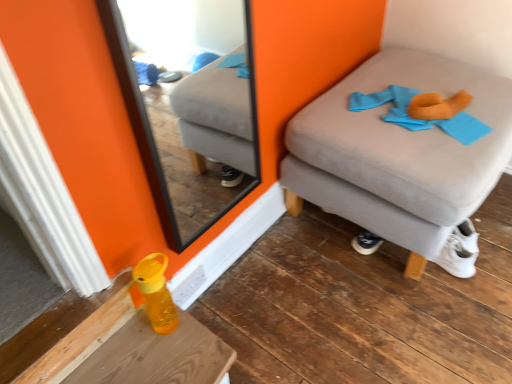
Where is `black-framed mirror at center`? This screenshot has height=384, width=512. black-framed mirror at center is located at coordinates (190, 104).

The image size is (512, 384). I want to click on suede ottoman at right, so click(399, 152).

What is the approximate height of wooden table at lower left?

The height of wooden table at lower left is 6.74 inches.

Find the location of a particular element. Image resolution: width=512 pixels, height=384 pixels. black-framed mirror at center is located at coordinates (190, 104).

Which of these two, blue fabric at upper right or suede ottoman at right, is bigger?

suede ottoman at right.

In the scene shown: Considering the positions of objects blue fabric at upper right and suede ottoman at right in the image provided, who is more to the right, blue fabric at upper right or suede ottoman at right?

suede ottoman at right.

Are blue fabric at upper right and suede ottoman at right located far from each other?

blue fabric at upper right is actually quite close to suede ottoman at right.

Is blue fabric at upper right looking in the opposite direction of suede ottoman at right?

Yes, blue fabric at upper right is facing away from suede ottoman at right.

From the image's perspective, is black-framed mirror at center located beneath wooden table at lower left?

Incorrect, from the image's perspective, black-framed mirror at center is higher than wooden table at lower left.

From a real-world perspective, does black-framed mirror at center stand above wooden table at lower left?

Yes, from a real-world perspective, black-framed mirror at center is on top of wooden table at lower left.

Consider the image. Considering the sizes of objects black-framed mirror at center and wooden table at lower left in the image provided, who is smaller, black-framed mirror at center or wooden table at lower left?

Smaller between the two is black-framed mirror at center.

Is black-framed mirror at center in contact with wooden table at lower left?

No, black-framed mirror at center is not with wooden table at lower left.

In the image, is wooden table at lower left on the left side or the right side of suede ottoman at right?

Clearly, wooden table at lower left is on the left of suede ottoman at right in the image.

Which point is more distant from viewer, (137, 363) or (325, 164)?

Point (325, 164)

Who is taller, wooden table at lower left or suede ottoman at right?

With more height is suede ottoman at right.

Who is smaller, wooden table at lower left or suede ottoman at right?

wooden table at lower left is smaller.

Considering the positions of points (366, 97) and (160, 332), is point (366, 97) closer to camera compared to point (160, 332)?

No, it is behind (160, 332).

At what (x,y) coordinates should I click in order to perform the action: click on clothe that appears behind the translucent yellow bottle at lower left. Please return your answer as a coordinate pair (x, y). Looking at the image, I should click on (423, 112).

Could you tell me if blue fabric at upper right is facing translucent yellow bottle at lower left?

No.

How many degrees apart are the facing directions of suede ottoman at right and blue fabric at upper right?

suede ottoman at right and blue fabric at upper right are facing 3.07 degrees away from each other.

Measure the distance between suede ottoman at right and blue fabric at upper right.

suede ottoman at right is 14.02 centimeters from blue fabric at upper right.

Is suede ottoman at right oriented towards blue fabric at upper right?

No, suede ottoman at right does not turn towards blue fabric at upper right.

Does suede ottoman at right contain blue fabric at upper right?

Yes, blue fabric at upper right can be found within suede ottoman at right.

Based on the photo, considering the sizes of objects black-framed mirror at center and blue fabric at upper right in the image provided, who is thinner, black-framed mirror at center or blue fabric at upper right?

black-framed mirror at center is thinner.

Considering the relative sizes of black-framed mirror at center and blue fabric at upper right in the image provided, is black-framed mirror at center taller than blue fabric at upper right?

Correct, black-framed mirror at center is much taller as blue fabric at upper right.

Are black-framed mirror at center and blue fabric at upper right far apart?

That's not correct — black-framed mirror at center is a little close to blue fabric at upper right.

Is wooden table at lower left to the right of blue fabric at upper right from the viewer's perspective?

No.

From a real-world perspective, is wooden table at lower left positioned under blue fabric at upper right based on gravity?

Yes, from a real-world perspective, wooden table at lower left is beneath blue fabric at upper right.

Does point (109, 318) lie behind point (385, 115)?

No, it is in front of (385, 115).

Is there a large distance between wooden table at lower left and blue fabric at upper right?

Indeed, wooden table at lower left is not near blue fabric at upper right.

Where is `clothe on the left of suede ottoman at right`? The image size is (512, 384). clothe on the left of suede ottoman at right is located at coordinates pos(423,112).

The width and height of the screenshot is (512, 384). In order to click on table below the black-framed mirror at center (from the image's perspective) in this screenshot , I will do `click(113, 345)`.

Considering their positions, is suede ottoman at right positioned closer to wooden table at lower left than black-framed mirror at center?

black-framed mirror at center is positioned closer to the anchor wooden table at lower left.

Based on their spatial positions, is wooden table at lower left or black-framed mirror at center closer to translucent yellow bottle at lower left?

Among the two, wooden table at lower left is located nearer to translucent yellow bottle at lower left.

When comparing their distances from translucent yellow bottle at lower left, does suede ottoman at right or black-framed mirror at center seem further?

black-framed mirror at center.

Which object lies further to the anchor point translucent yellow bottle at lower left, suede ottoman at right or blue fabric at upper right?

blue fabric at upper right.

From the image, which object appears to be farther from wooden table at lower left, translucent yellow bottle at lower left or blue fabric at upper right?

The object further to wooden table at lower left is blue fabric at upper right.

When comparing their distances from black-framed mirror at center, does translucent yellow bottle at lower left or blue fabric at upper right seem closer?

Among the two, blue fabric at upper right is located nearer to black-framed mirror at center.

Which object lies further to the anchor point black-framed mirror at center, wooden table at lower left or translucent yellow bottle at lower left?

translucent yellow bottle at lower left is positioned further to the anchor black-framed mirror at center.

Which object lies further to the anchor point suede ottoman at right, translucent yellow bottle at lower left or black-framed mirror at center?

translucent yellow bottle at lower left is positioned further to the anchor suede ottoman at right.

The width and height of the screenshot is (512, 384). I want to click on mirror between blue fabric at upper right and wooden table at lower left from top to bottom, so click(190, 104).

Find the location of a particular element. The image size is (512, 384). table between translucent yellow bottle at lower left and blue fabric at upper right is located at coordinates [x=113, y=345].

Image resolution: width=512 pixels, height=384 pixels. I want to click on bottle that lies between black-framed mirror at center and wooden table at lower left from top to bottom, so click(156, 292).

Where is `clothe between black-framed mirror at center and suede ottoman at right in the horizontal direction`? clothe between black-framed mirror at center and suede ottoman at right in the horizontal direction is located at coordinates (423, 112).